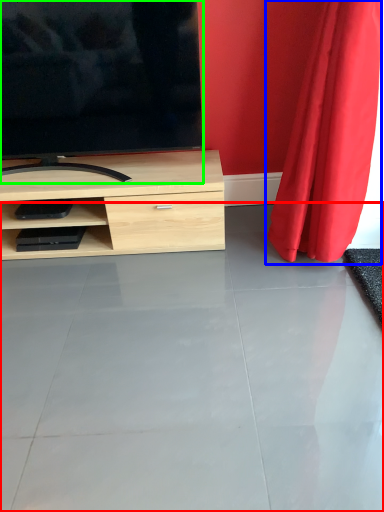
Question: Estimate the real-world distances between objects in this image. Which object is closer to concrete (highlighted by a red box), curtain (highlighted by a blue box) or television (highlighted by a green box)?

Choices:
 (A) curtain
 (B) television

Answer: (A)